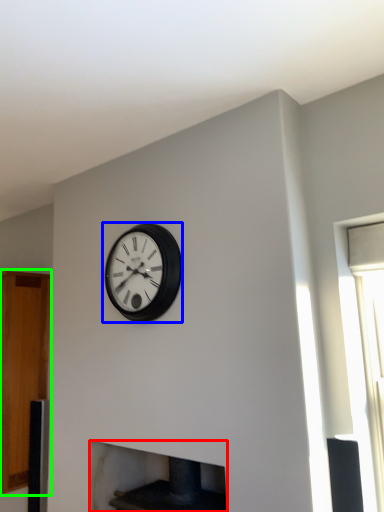
Question: Estimate the real-world distances between objects in this image. Which object is closer to fireplace (highlighted by a red box), wall clock (highlighted by a blue box) or cabinetry (highlighted by a green box)?

Choices:
 (A) wall clock
 (B) cabinetry

Answer: (B)